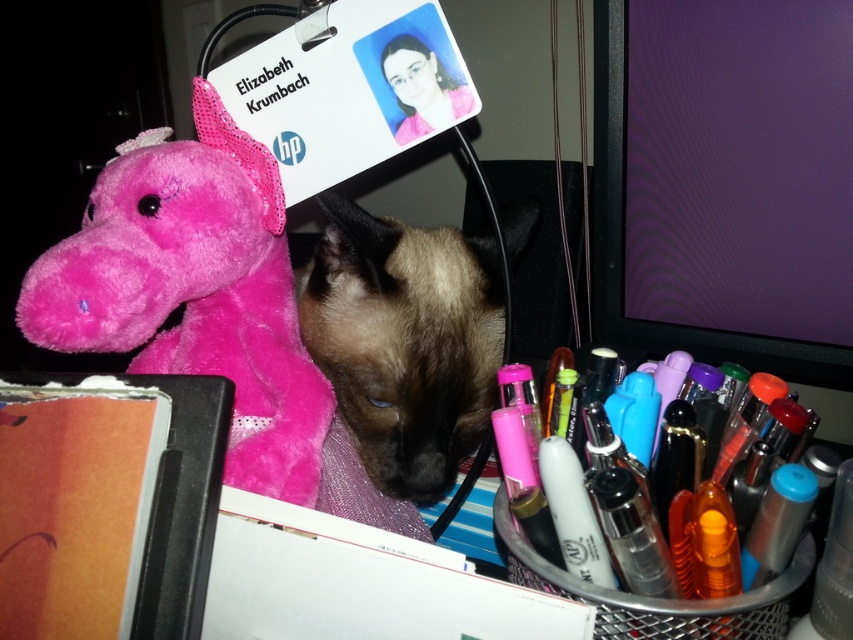
Describe the element at coordinates (194, 291) in the screenshot. This screenshot has width=853, height=640. I see `fuzzy pink stuffed animal at left` at that location.

Between fuzzy pink stuffed animal at left and brown fur cat at center, which one appears on the right side from the viewer's perspective?

brown fur cat at center is more to the right.

Which is in front, point (218, 109) or point (521, 230)?

Point (218, 109) is more forward.

Locate an element on the screen. The height and width of the screenshot is (640, 853). fuzzy pink stuffed animal at left is located at coordinates (194, 291).

Is point (821, 202) closer to camera compared to point (384, 371)?

That is False.

Between point (737, 51) and point (525, 196), which one is positioned behind?

The point (737, 51) is behind.

What do you see at coordinates (726, 180) in the screenshot? This screenshot has width=853, height=640. I see `purple glossy monitor at upper right` at bounding box center [726, 180].

Locate an element on the screen. Image resolution: width=853 pixels, height=640 pixels. purple glossy monitor at upper right is located at coordinates (726, 180).

From the picture: Is purple glossy monitor at upper right wider than fuzzy pink stuffed animal at left?

Indeed, purple glossy monitor at upper right has a greater width compared to fuzzy pink stuffed animal at left.

Can you confirm if purple glossy monitor at upper right is shorter than fuzzy pink stuffed animal at left?

Incorrect, purple glossy monitor at upper right's height does not fall short of fuzzy pink stuffed animal at left's.

Who is more forward, [688,180] or [158,291]?

Positioned in front is point [158,291].

Where is `purple glossy monitor at upper right`? purple glossy monitor at upper right is located at coordinates (726, 180).